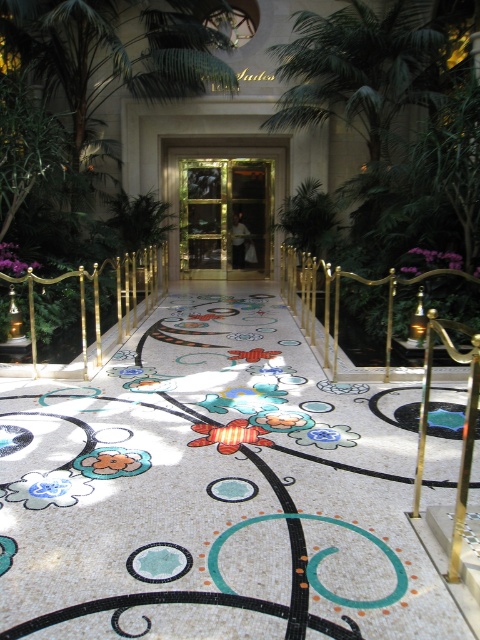
Question: Can you confirm if white mosaic floor at center is positioned to the right of gold polished metal railing at center?

Choices:
 (A) yes
 (B) no

Answer: (B)

Question: Does white mosaic floor at center have a lesser width compared to gold polished metal railing at center?

Choices:
 (A) no
 (B) yes

Answer: (A)

Question: Which point appears farthest from the camera in this image?

Choices:
 (A) (93, 300)
 (B) (321, 256)
 (C) (463, 326)

Answer: (B)

Question: Is white mosaic floor at center thinner than gold/glass door at center?

Choices:
 (A) no
 (B) yes

Answer: (A)

Question: Which is nearer to the gold polished metal railing at center?

Choices:
 (A) gold polished metal balustrade at center
 (B) gold/glass door at center
 (C) white mosaic floor at center

Answer: (C)

Question: Which point is farther from the camera taking this photo?

Choices:
 (A) (386, 321)
 (B) (230, 176)

Answer: (B)